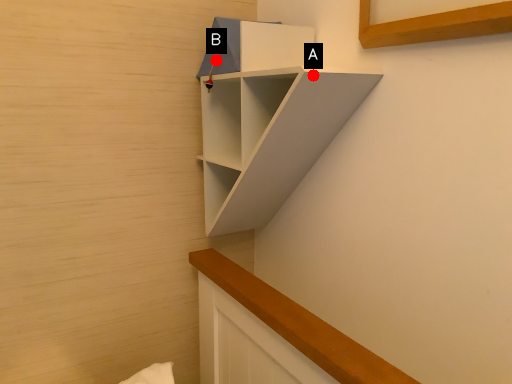
Question: Two points are circled on the image, labeled by A and B beside each circle. Which point is farther from the camera taking this photo?

Choices:
 (A) A is further
 (B) B is further

Answer: (B)